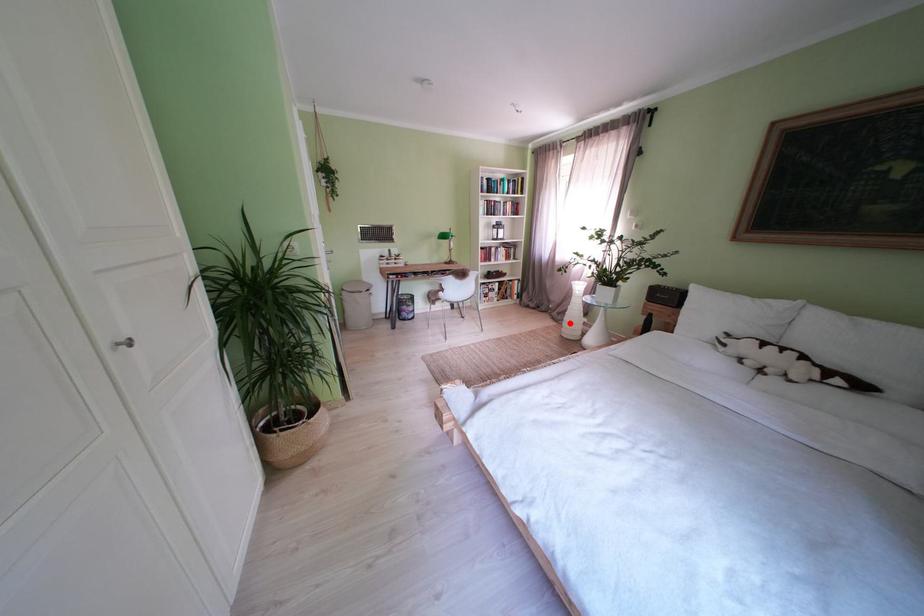
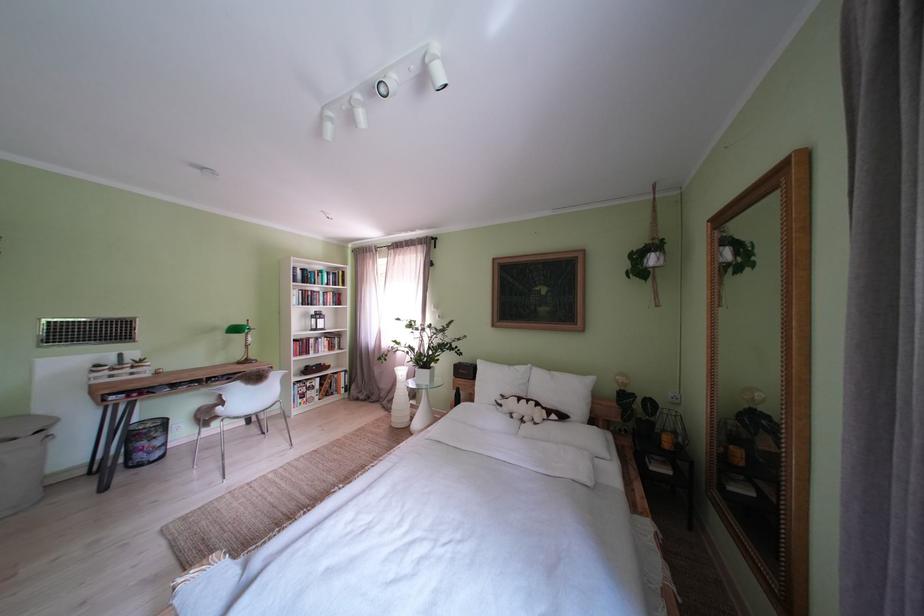
In the second image, find the point that corresponds to the highlighted location in the first image.

(400, 411)